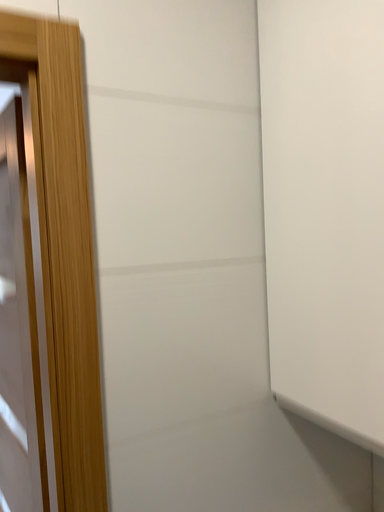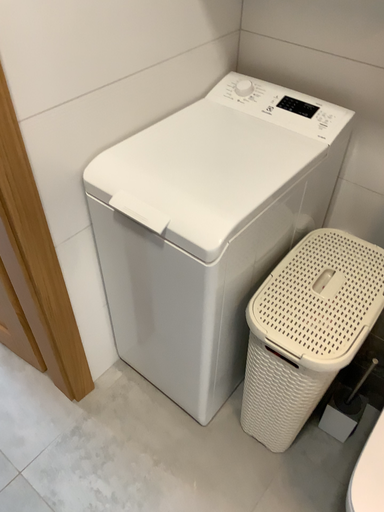
Question: Which way did the camera rotate in the video?

Choices:
 (A) rotated left
 (B) rotated right

Answer: (B)